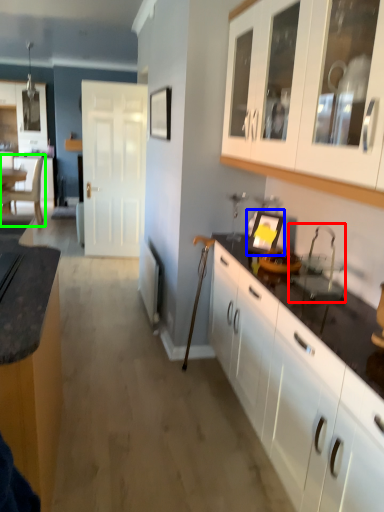
Question: Which object is positioned closest to sink (highlighted by a red box)? Select from appliance (highlighted by a blue box) and chair (highlighted by a green box).

Choices:
 (A) appliance
 (B) chair

Answer: (A)